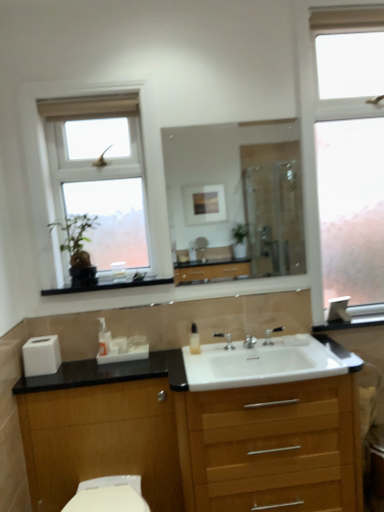
Find the location of a particular element. This screenshot has height=512, width=384. vacant area situated to the left side of silver metallic tap at center, which is counted as the 1th tap, starting from the right is located at coordinates (244, 348).